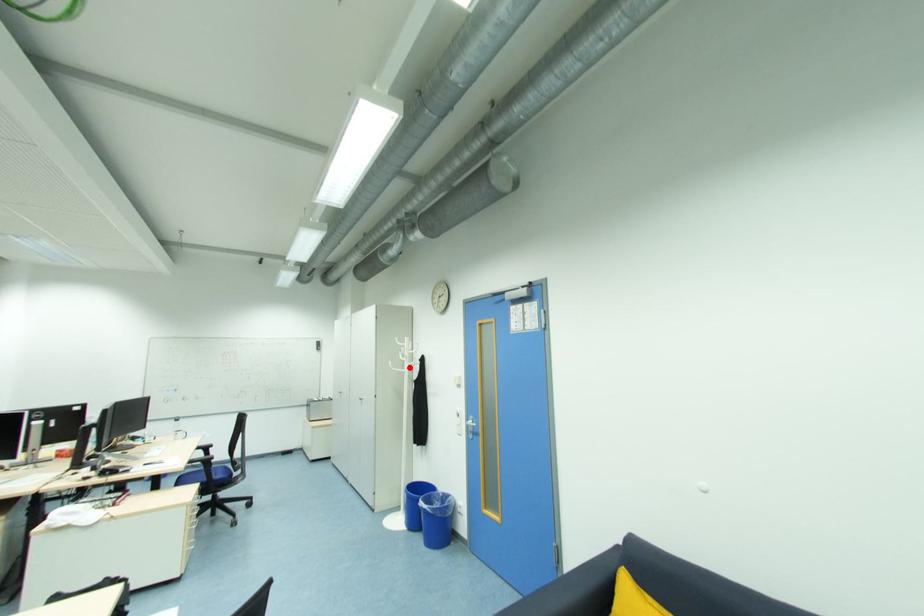
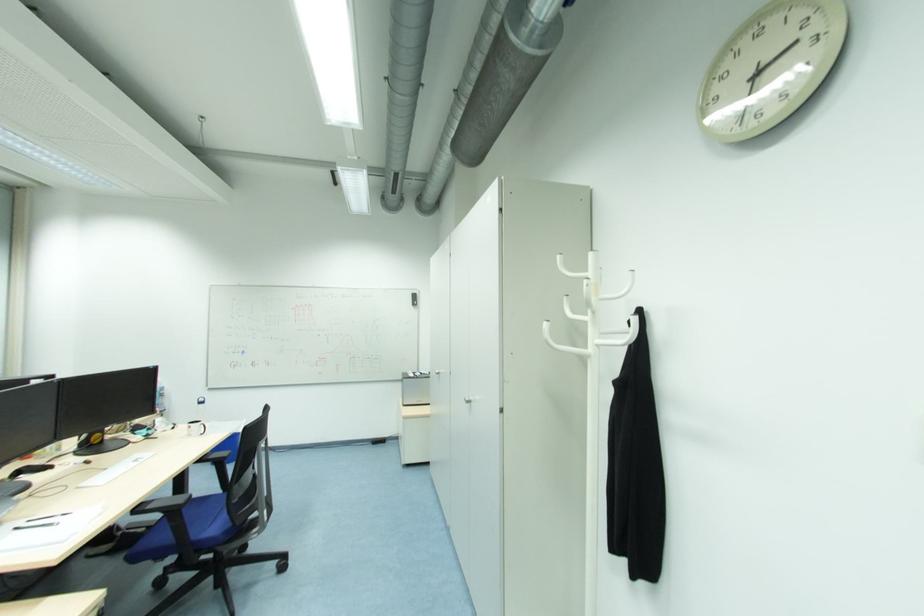
The point at the highlighted location is marked in the first image. Where is the corresponding point in the second image?

(596, 341)